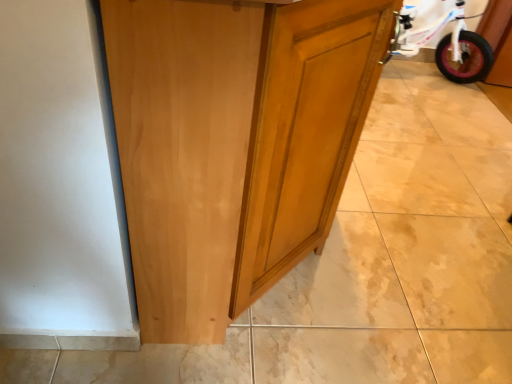
What do you see at coordinates (444, 44) in the screenshot? I see `pink rubber tire at right` at bounding box center [444, 44].

You are a GUI agent. You are given a task and a screenshot of the screen. Output one action in this format:
    pyautogui.click(x=<x>, y=<y>)
    Task: Click on the pink rubber tire at right
    The image size is (512, 384).
    Given the screenshot: What is the action you would take?
    pyautogui.click(x=444, y=44)

What is the approximate height of pink rubber tire at right?

pink rubber tire at right is 50.72 centimeters in height.

This screenshot has height=384, width=512. I want to click on glossy wood cupboard at center, so 234,144.

Describe the element at coordinates (234, 144) in the screenshot. The height and width of the screenshot is (384, 512). I see `glossy wood cupboard at center` at that location.

The image size is (512, 384). Identify the location of pink rubber tire at right. pos(444,44).

Would you say glossy wood cupboard at center is to the left or to the right of pink rubber tire at right in the picture?

glossy wood cupboard at center is positioned on pink rubber tire at right's left side.

Is glossy wood cupboard at center further to camera compared to pink rubber tire at right?

No, it is in front of pink rubber tire at right.

Between point (222, 207) and point (396, 49), which one is positioned in front?

Point (222, 207)

From the image's perspective, relative to pink rubber tire at right, is glossy wood cupboard at center above or below?

Clearly, from the image's perspective, glossy wood cupboard at center is below pink rubber tire at right.

From a real-world perspective, is glossy wood cupboard at center located higher than pink rubber tire at right?

Correct, in the physical world, glossy wood cupboard at center is higher than pink rubber tire at right.

Can you confirm if glossy wood cupboard at center is thinner than pink rubber tire at right?

In fact, glossy wood cupboard at center might be wider than pink rubber tire at right.

Who is shorter, glossy wood cupboard at center or pink rubber tire at right?

Standing shorter between the two is pink rubber tire at right.

Is glossy wood cupboard at center bigger or smaller than pink rubber tire at right?

Considering their sizes, glossy wood cupboard at center takes up more space than pink rubber tire at right.

Is glossy wood cupboard at center not inside pink rubber tire at right?

glossy wood cupboard at center lies outside pink rubber tire at right's area.

Is glossy wood cupboard at center next to pink rubber tire at right and touching it?

No, glossy wood cupboard at center is not in contact with pink rubber tire at right.

Is pink rubber tire at right at the back of glossy wood cupboard at center?

That's not correct — glossy wood cupboard at center is not looking away from pink rubber tire at right.

What are the coordinates of `cupboard that is below the pink rubber tire at right (from the image's perspective)` in the screenshot? It's located at (234, 144).

Does pink rubber tire at right appear on the right side of glossy wood cupboard at center?

Correct, you'll find pink rubber tire at right to the right of glossy wood cupboard at center.

Does pink rubber tire at right lie behind glossy wood cupboard at center?

Yes, pink rubber tire at right is further from the camera.

Which is nearer, (492,62) or (280,74)?

Point (492,62) is farther from the camera than point (280,74).

From the image's perspective, is pink rubber tire at right above or below glossy wood cupboard at center?

Based on their image positions, pink rubber tire at right is located above glossy wood cupboard at center.

From a real-world perspective, is pink rubber tire at right on glossy wood cupboard at center?

No.

Between pink rubber tire at right and glossy wood cupboard at center, which one has smaller width?

With smaller width is pink rubber tire at right.

In the scene shown: Between pink rubber tire at right and glossy wood cupboard at center, which one has less height?

pink rubber tire at right.

Who is smaller, pink rubber tire at right or glossy wood cupboard at center?

With smaller size is pink rubber tire at right.

Is glossy wood cupboard at center surrounded by pink rubber tire at right?

That's incorrect, glossy wood cupboard at center is not inside pink rubber tire at right.

Consider the image. Is pink rubber tire at right placed right next to glossy wood cupboard at center?

No, pink rubber tire at right is not beside glossy wood cupboard at center.

Is pink rubber tire at right facing away from glossy wood cupboard at center?

No, pink rubber tire at right's orientation is not away from glossy wood cupboard at center.

How different are the orientations of pink rubber tire at right and glossy wood cupboard at center in degrees?

96.9 degrees separate the facing orientations of pink rubber tire at right and glossy wood cupboard at center.

At what (x,y) coordinates should I click in order to perform the action: click on bicycle below the glossy wood cupboard at center (from a real-world perspective). Please return your answer as a coordinate pair (x, y). The width and height of the screenshot is (512, 384). Looking at the image, I should click on (444, 44).

Find the location of `bicycle located above the glossy wood cupboard at center (from the image's perspective)`. bicycle located above the glossy wood cupboard at center (from the image's perspective) is located at coordinates (444, 44).

The height and width of the screenshot is (384, 512). In order to click on bicycle below the glossy wood cupboard at center (from a real-world perspective) in this screenshot , I will do `click(444, 44)`.